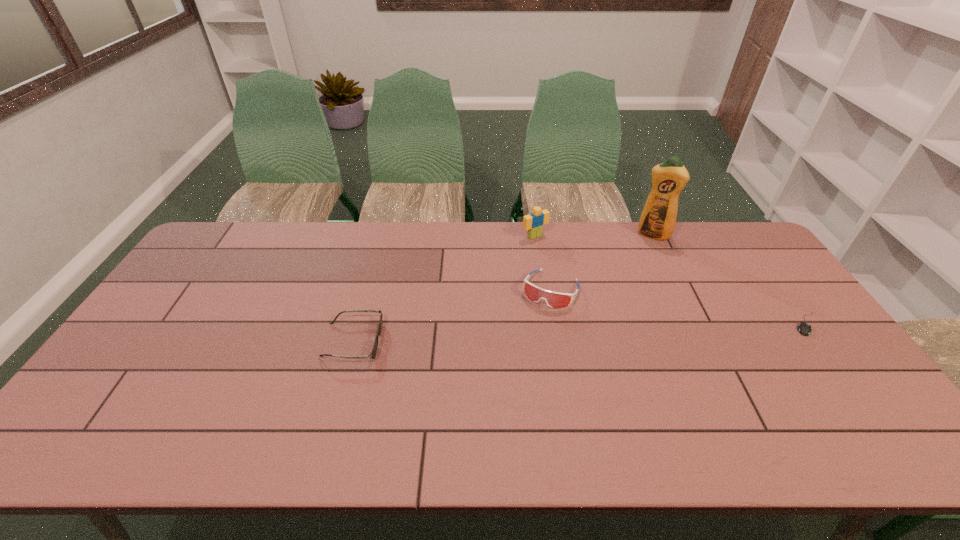
This screenshot has height=540, width=960. In order to click on empty location between the mouse and the third shortest object in this screenshot , I will do `click(679, 306)`.

The height and width of the screenshot is (540, 960). In order to click on blank region between the Lego and the tallest object in this screenshot , I will do `click(594, 235)`.

The width and height of the screenshot is (960, 540). I want to click on free space between the mouse and the Lego, so click(671, 280).

You are a GUI agent. You are given a task and a screenshot of the screen. Output one action in this format:
    pyautogui.click(x=<x>, y=<y>)
    Task: Click on the free spot between the shortest object and the third farthest object
    The height and width of the screenshot is (540, 960).
    Given the screenshot: What is the action you would take?
    pyautogui.click(x=679, y=306)

At what (x,y) coordinates should I click in order to perform the action: click on blank region between the detergent and the mouse. Please return your answer as a coordinate pair (x, y). This screenshot has height=540, width=960. Looking at the image, I should click on (730, 279).

Locate an element on the screen. The height and width of the screenshot is (540, 960). empty space between the Lego and the third nearest object is located at coordinates [542, 262].

Find the location of `vacant space in between the second tallest object and the detergent`. vacant space in between the second tallest object and the detergent is located at coordinates (594, 235).

Locate an element on the screen. The width and height of the screenshot is (960, 540). vacant region between the sunglasses and the shortest object is located at coordinates (580, 333).

The width and height of the screenshot is (960, 540). Identify the location of object that stands as the second closest to the detergent. (534, 222).

Identify the location of object that stands as the closest to the mouse. (658, 218).